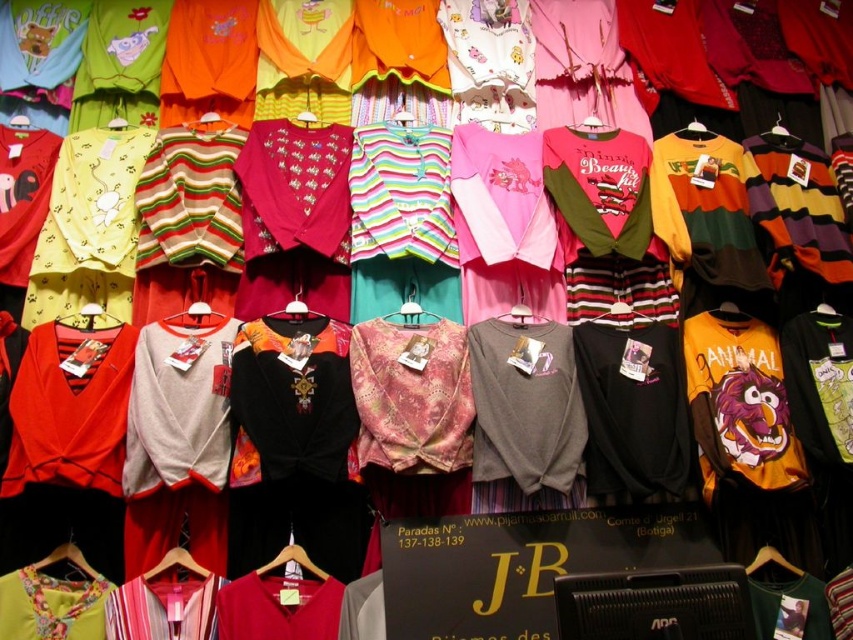
You are a customer looking at the wall of children clothing. You see a point at coordinates (705, 209). Which clothing item is this point located on?

The point at coordinates (705, 209) is on the multicolored striped sweater at center.

You are a parent looking to organize childrens clothing. You see a matte red sweater at left and a matte fabric shirt at center. Which item is positioned lower on the wall?

The matte red sweater at left is positioned below the matte fabric shirt at center, so it is lower on the wall.

You are a parent looking to buy a new outfit for your child. You see the matte red sweater at left and the matte fabric shirt at center. Which one is closer to you?

The matte red sweater at left is closer to you because it is in front of the matte fabric shirt at center.